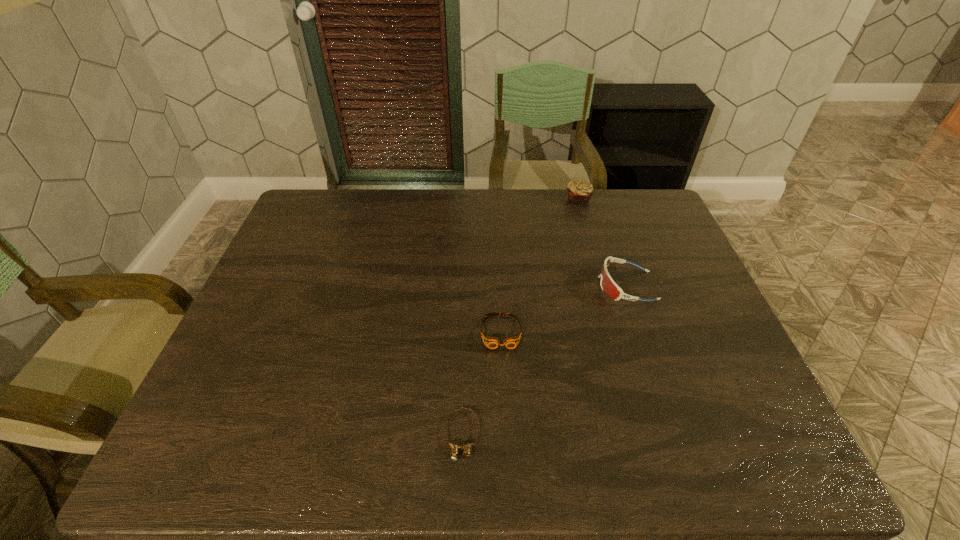
Locate an element on the screen. The image size is (960, 540). vacant space situated 0.210m on the front-facing side of the third nearest object is located at coordinates (523, 286).

Where is `vacant space located 0.150m with the lenses facing forward on the second nearest object`? This screenshot has height=540, width=960. vacant space located 0.150m with the lenses facing forward on the second nearest object is located at coordinates (504, 406).

I want to click on object situated at the far edge, so click(x=579, y=190).

The image size is (960, 540). I want to click on object that is positioned at the near edge, so click(x=454, y=448).

Locate an element on the screen. object present at the right edge is located at coordinates (610, 288).

Find the location of a particular element. Image resolution: width=960 pixels, height=540 pixels. free space at the far edge of the desktop is located at coordinates (433, 227).

I want to click on free region at the left edge, so click(x=271, y=291).

I want to click on vacant region at the right edge of the desktop, so tap(685, 292).

Where is `free location at the far left corner`? The image size is (960, 540). free location at the far left corner is located at coordinates (337, 204).

Image resolution: width=960 pixels, height=540 pixels. In the image, there is a desktop. Identify the location of vacant space at the near left corner. (228, 455).